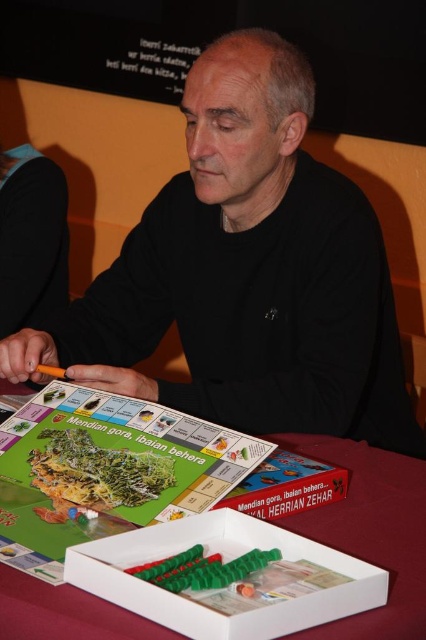
You are a fashion designer observing a man wearing a black matte shirt at center and a red cloth at lower center. Which item is taller?

The black matte shirt at center has a greater height compared to the red cloth at lower center.

You are a fashion designer observing the man in the scene. You need to decide which item is more suitable for a summer collection based on their sizes. Which item between the black matte shirt at center and the red cloth at lower center should you choose?

The black matte shirt at center has a larger size compared to the red cloth at lower center, so it would be more suitable for a summer collection as larger items can accommodate airflow better.